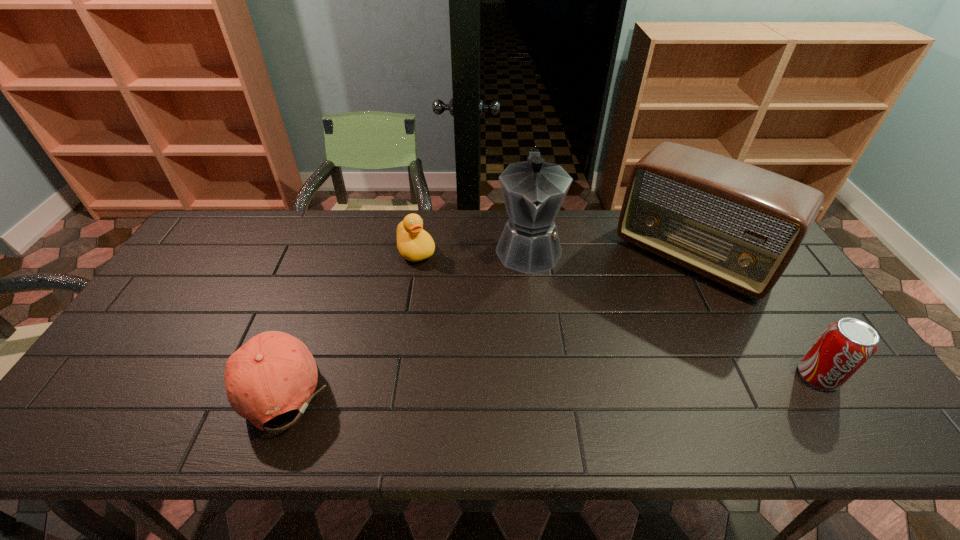
Locate an element on the screen. The width and height of the screenshot is (960, 540). free region at the near right corner of the desktop is located at coordinates [868, 389].

At what (x,y) coordinates should I click in order to perform the action: click on free space between the coffeepot and the second object from left to right. Please return your answer as a coordinate pair (x, y). The width and height of the screenshot is (960, 540). Looking at the image, I should click on (472, 249).

Locate an element on the screen. This screenshot has width=960, height=540. free area in between the fourth object from right to left and the soda can is located at coordinates (617, 313).

Locate an element on the screen. free space between the leftmost object and the duck is located at coordinates (349, 316).

This screenshot has height=540, width=960. Identify the location of free point between the leftmost object and the radio receiver. (487, 320).

Find the location of a particular element. This screenshot has height=540, width=960. unoccupied position between the second object from left to right and the leftmost object is located at coordinates (349, 316).

What are the coordinates of `vacant point located between the coffeepot and the leftmost object` in the screenshot? It's located at (405, 315).

You are a GUI agent. You are given a task and a screenshot of the screen. Output one action in this format:
    pyautogui.click(x=<x>, y=<y>)
    Task: Click on the free space between the third object from left to right and the baseball cap
    The width and height of the screenshot is (960, 540).
    Given the screenshot: What is the action you would take?
    pyautogui.click(x=405, y=315)

Where is `free space between the third object from right to left and the soda can`? This screenshot has width=960, height=540. free space between the third object from right to left and the soda can is located at coordinates (673, 312).

Find the location of a particular element. The image size is (960, 540). empty space between the duck and the leftmost object is located at coordinates (349, 316).